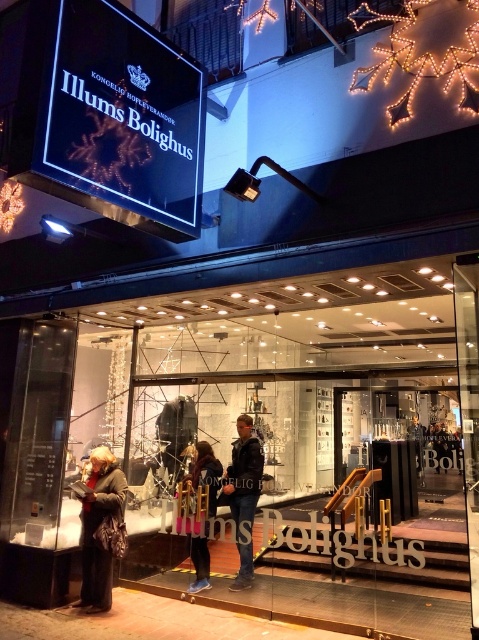
Looking at this image, can you confirm if leather jacket at lower left is shorter than denim jacket at center?

In fact, leather jacket at lower left may be taller than denim jacket at center.

Where is `leather jacket at lower left`? The height and width of the screenshot is (640, 479). leather jacket at lower left is located at coordinates (101, 529).

Between point (114, 484) and point (218, 488), which one is positioned in front?

Point (114, 484)

This screenshot has height=640, width=479. Identify the location of leather jacket at lower left. (101, 529).

Which is behind, point (255, 492) or point (197, 442)?

Positioned behind is point (197, 442).

Can you confirm if dark blue jeans at center is shorter than denim jacket at center?

No.

What do you see at coordinates (243, 493) in the screenshot? Image resolution: width=479 pixels, height=640 pixels. I see `dark blue jeans at center` at bounding box center [243, 493].

Image resolution: width=479 pixels, height=640 pixels. Identify the location of dark blue jeans at center. (243, 493).

Between point (101, 445) and point (247, 554), which one is positioned in front?

Point (247, 554) is more forward.

Between leather jacket at lower left and dark blue jeans at center, which one appears on the right side from the viewer's perspective?

From the viewer's perspective, dark blue jeans at center appears more on the right side.

What are the coordinates of `leather jacket at lower left` in the screenshot? It's located at (101, 529).

The image size is (479, 640). In order to click on leather jacket at lower left in this screenshot , I will do `click(101, 529)`.